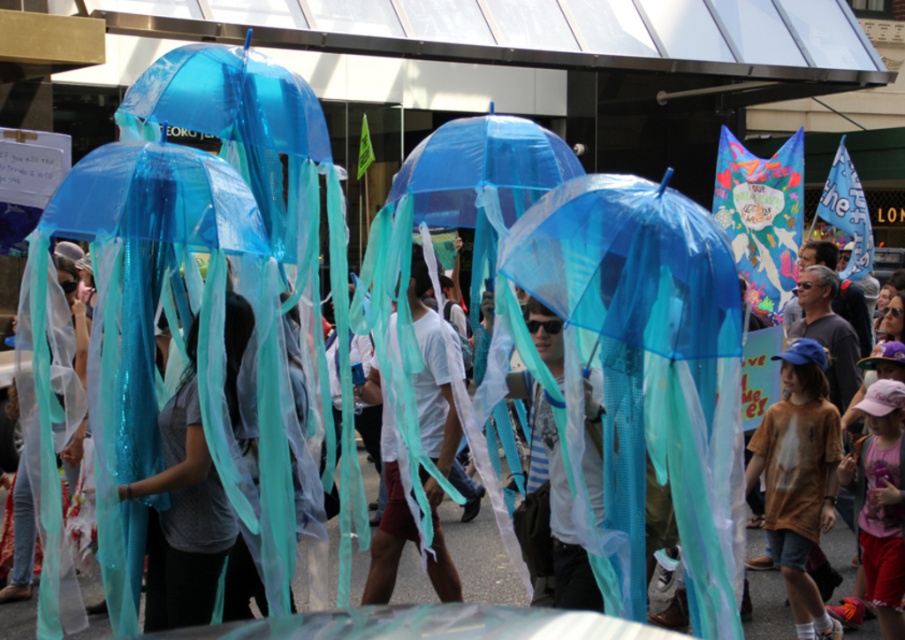
Does matte blue umbrella at center have a greater width compared to brown cotton shirt at center?

Incorrect, matte blue umbrella at center's width does not surpass brown cotton shirt at center's.

Is point (586, 435) closer to viewer compared to point (860, 586)?

Yes, point (586, 435) is closer to viewer.

Measure the distance between matte blue umbrella at center and camera.

A distance of 3.87 meters exists between matte blue umbrella at center and camera.

This screenshot has height=640, width=905. Identify the location of matte blue umbrella at center. (558, 506).

Is point (595, 227) behind point (883, 616)?

No, (595, 227) is in front of (883, 616).

Does transparent plastic umbrella at center have a greater width compared to pink fabric hat at lower right?

Indeed, transparent plastic umbrella at center has a greater width compared to pink fabric hat at lower right.

Between point (596, 248) and point (886, 484), which one is positioned in front?

Point (596, 248)

Where is `transparent plastic umbrella at center`? transparent plastic umbrella at center is located at coordinates (648, 369).

Can you confirm if transparent plastic umbrella at center is wider than white matte t-shirt at center?

Yes, transparent plastic umbrella at center is wider than white matte t-shirt at center.

At what (x,y) coordinates should I click in order to perform the action: click on transparent plastic umbrella at center. Please return your answer as a coordinate pair (x, y). Looking at the image, I should click on (648, 369).